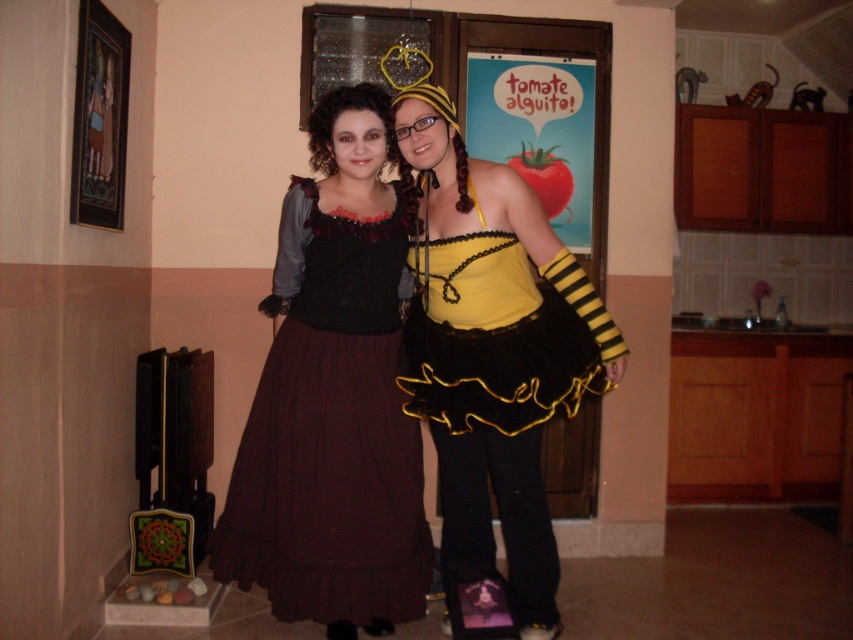
Question: Where is matte black dress at center located in relation to dark red satin dress at center in the image?

Choices:
 (A) above
 (B) below

Answer: (A)

Question: Among these points, which one is nearest to the camera?

Choices:
 (A) (450, 340)
 (B) (343, 531)

Answer: (B)

Question: Does matte black dress at center have a larger size compared to dark red satin dress at center?

Choices:
 (A) yes
 (B) no

Answer: (A)

Question: Does matte black dress at center appear under dark red satin dress at center?

Choices:
 (A) yes
 (B) no

Answer: (B)

Question: Which object appears farthest from the camera in this image?

Choices:
 (A) dark red satin dress at center
 (B) matte black dress at center

Answer: (A)